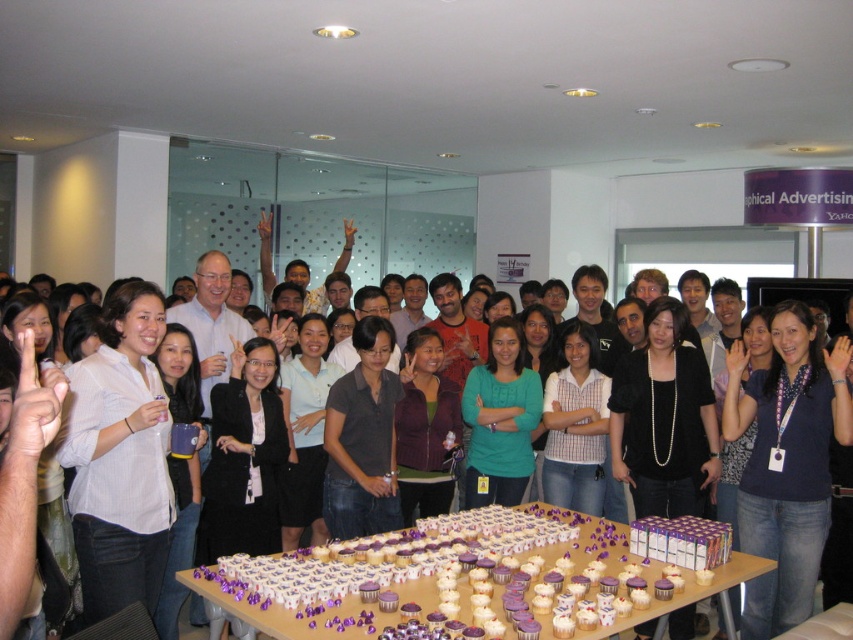
You are standing at the center of the room and want to reach the two points indicated in the image. Which point, point (245,602) or point (726,355), is closer to you?

Point (245,602) is closer to you because it is in front of point (726,355).